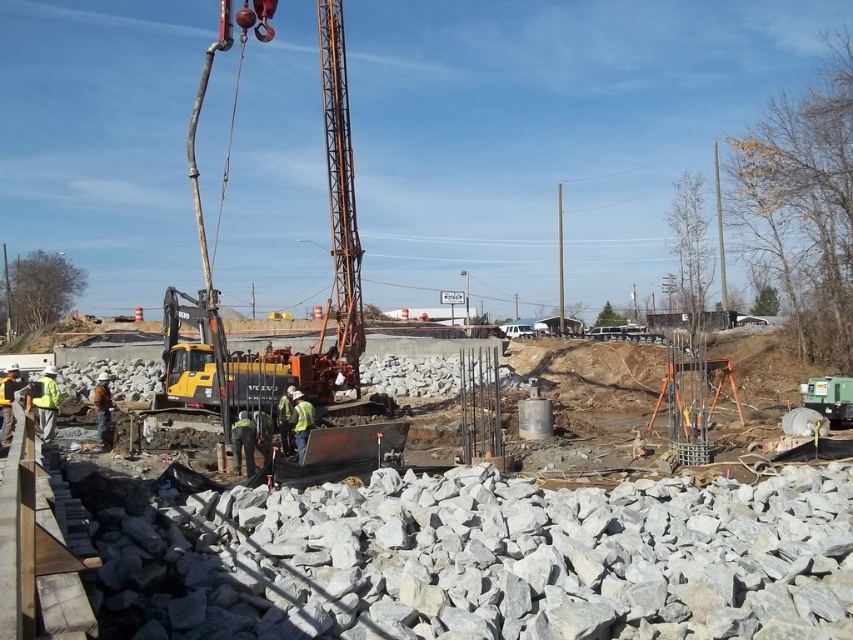
You are a construction worker planning to move a heavy equipment from the gray concrete construction site at center to the yellow metallic excavator at center. Considering their sizes, which one can accommodate the equipment more easily?

The yellow metallic excavator at center can accommodate the equipment more easily since it has a larger size compared to the gray concrete construction site at center.

You are a construction worker standing at the yellow excavator with a red crane arm. You need to move a heavy object from point A to point B. Point A is at point (815, 561), and point B is at point (355, 234). Can you determine which point is closer to your current position?

Point A at (815, 561) is closer to your current position at the yellow excavator with a red crane arm because it is in front of point B at (355, 234).

You are a construction worker standing on the gray concrete construction site at center. You want to reach the yellow metallic excavator at center to operate it. Is the excavator above or below your current position?

The gray concrete construction site at center is below the yellow metallic excavator at center, so the excavator is above your current position. You will need to move upwards to reach it.